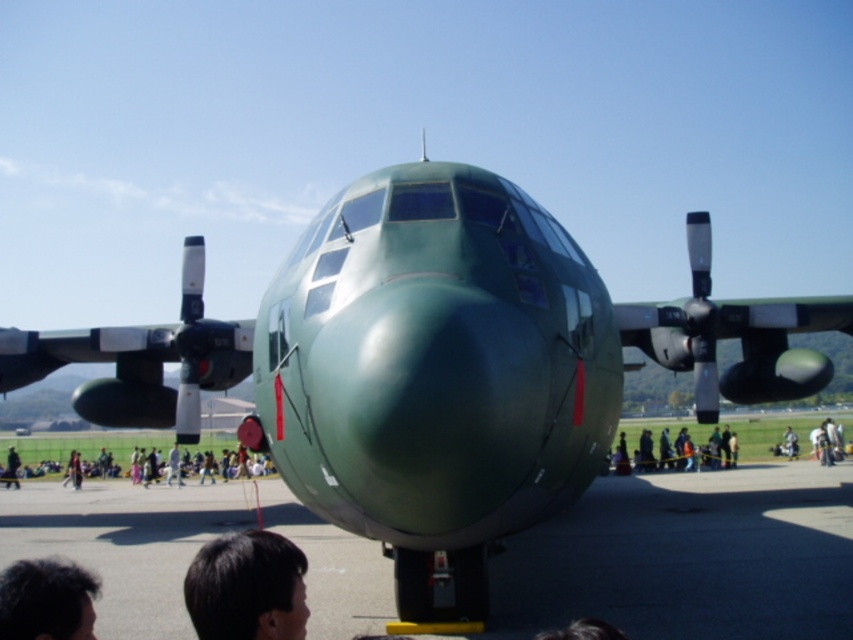
Question: Which point is closer to the camera?

Choices:
 (A) dark brown hair at lower left
 (B) black hair at lower left

Answer: (A)

Question: Is dark brown hair at lower left smaller than light brown fabric jacket at lower left?

Choices:
 (A) yes
 (B) no

Answer: (B)

Question: Among these points, which one is nearest to the camera?

Choices:
 (A) (770, 474)
 (B) (13, 460)
 (C) (10, 627)

Answer: (C)

Question: Among these points, which one is farthest from the camera?

Choices:
 (A) 10,460
 (B) 82,577
 (C) 698,515

Answer: (A)

Question: Does green matte tarmac at center appear under dark brown hair at lower center?

Choices:
 (A) yes
 (B) no

Answer: (A)

Question: Is dark brown hair at lower center wider than dark blue uniform at lower left?

Choices:
 (A) no
 (B) yes

Answer: (B)